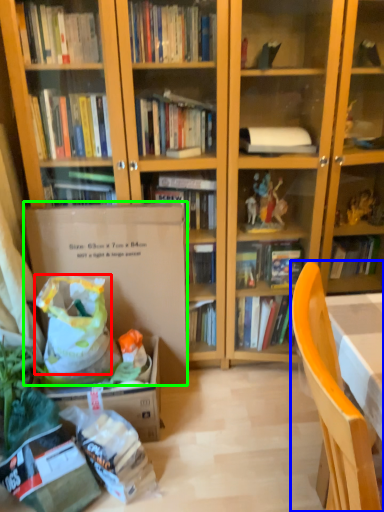
Question: Which object is the farthest from grocery bag (highlighted by a red box)? Choose among these: chair (highlighted by a blue box) or paperback book (highlighted by a green box).

Choices:
 (A) chair
 (B) paperback book

Answer: (A)